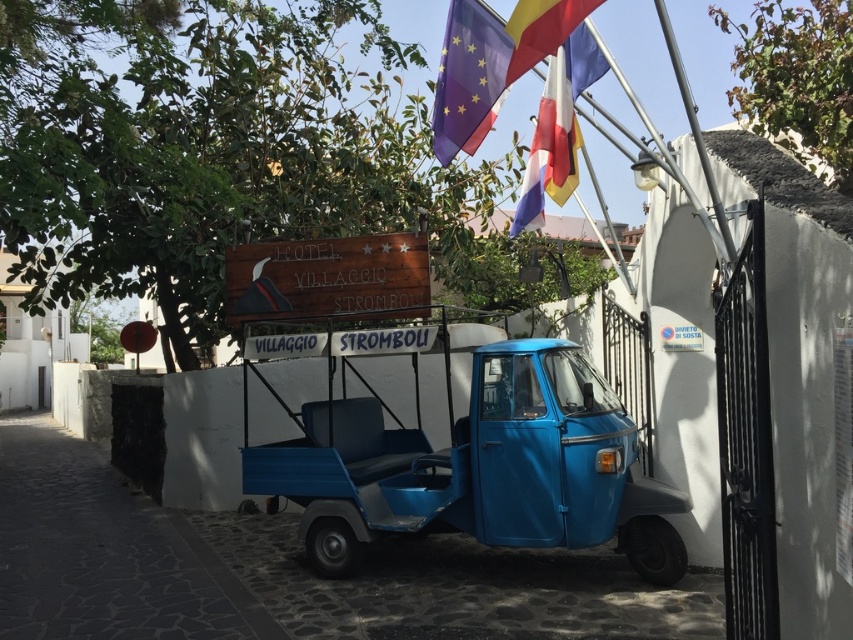
Who is higher up, purple fabric flag at upper center or yellow fabric flag at upper center?

purple fabric flag at upper center is higher up.

This screenshot has height=640, width=853. Identify the location of purple fabric flag at upper center. (468, 77).

Does blue plastic tuk-tuk at center have a larger size compared to purple fabric flag at upper center?

Correct, blue plastic tuk-tuk at center is larger in size than purple fabric flag at upper center.

Can you confirm if blue plastic tuk-tuk at center is positioned to the right of purple fabric flag at upper center?

Incorrect, blue plastic tuk-tuk at center is not on the right side of purple fabric flag at upper center.

Which is behind, point (555, 620) or point (444, 51)?

The point (444, 51) is more distant.

This screenshot has height=640, width=853. In order to click on blue plastic tuk-tuk at center in this screenshot , I will do coord(283,572).

Can you confirm if blue matte truck at center is positioned above yellow fabric flag at upper center?

No, blue matte truck at center is not above yellow fabric flag at upper center.

Which of these two, blue matte truck at center or yellow fabric flag at upper center, stands taller?

blue matte truck at center

Consider the image. Who is more distant from viewer, [450,497] or [526,4]?

Positioned behind is point [450,497].

Where is `blue matte truck at center`? The image size is (853, 640). blue matte truck at center is located at coordinates (469, 460).